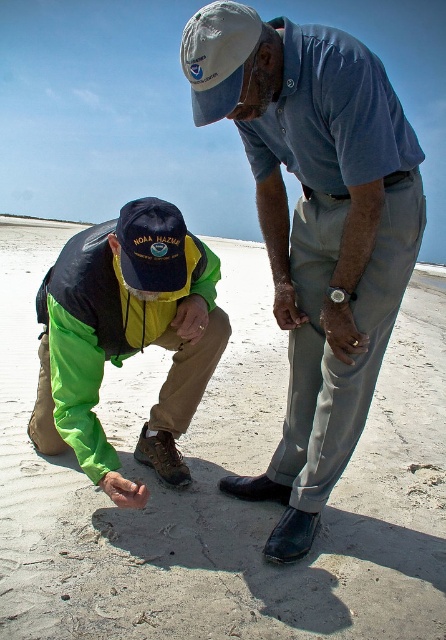
You are a lifeguard on duty and need to retrieve an object from the beach. The smooth sand at lower center is where the object is located. If you are standing at the position of the white fabric baseball cap at upper center, can you reach the object without moving more than 15 feet?

The smooth sand at lower center is 17.66 feet away from the white fabric baseball cap at upper center. Since 17.66 feet exceeds the 15 feet limit, you cannot reach the object without moving more than 15 feet.